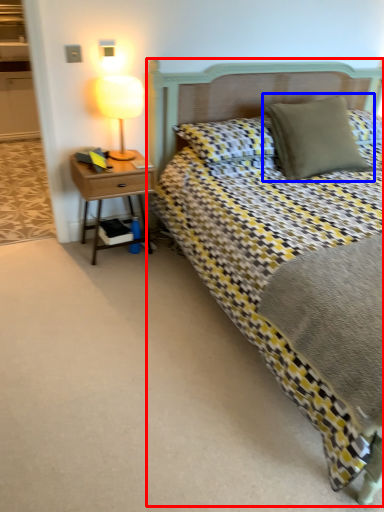
Question: Which of the following is the closest to the observer, bed (highlighted by a red box) or pillow (highlighted by a blue box)?

Choices:
 (A) bed
 (B) pillow

Answer: (A)